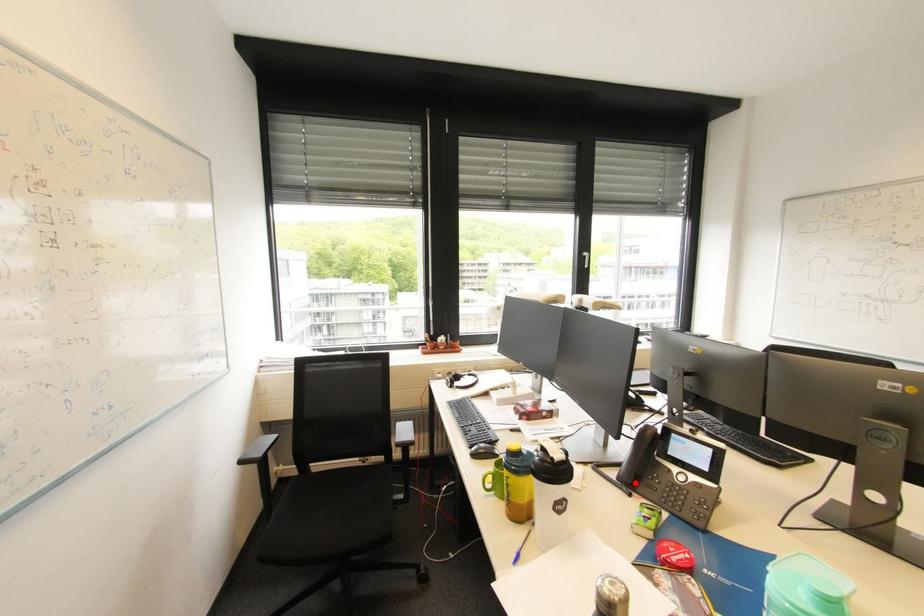
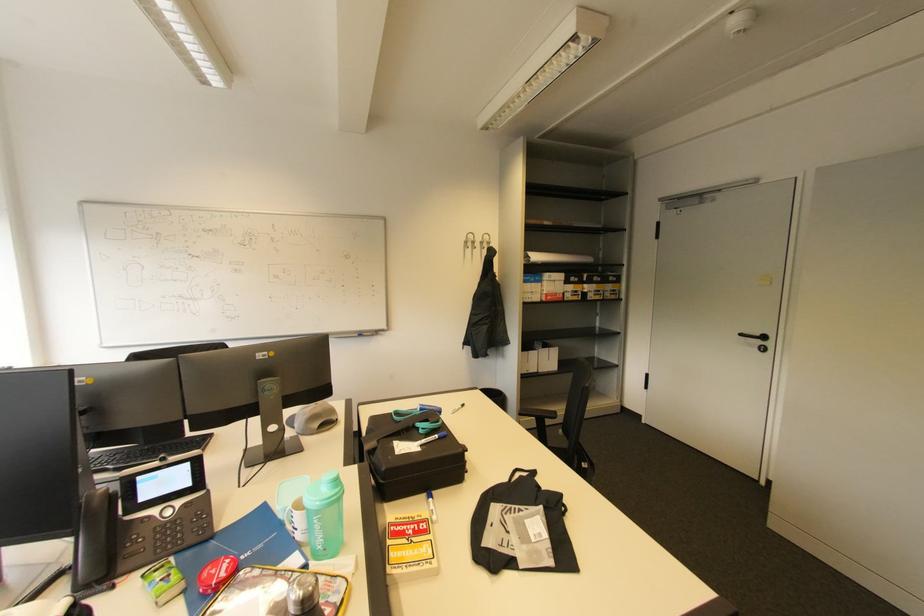
Question: I am providing you with two images of the same scene from different viewpoints. In image1, a red point is highlighted. Considering the same 3D point in image2, which of the following is correct?

Choices:
 (A) It is closer
 (B) It is farther

Answer: (B)